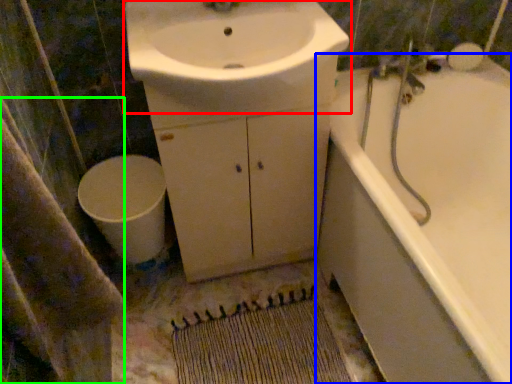
Question: Estimate the real-world distances between objects in this image. Which object is farther from sink (highlighted by a red box), bathtub (highlighted by a blue box) or bath towel (highlighted by a green box)?

Choices:
 (A) bathtub
 (B) bath towel

Answer: (B)